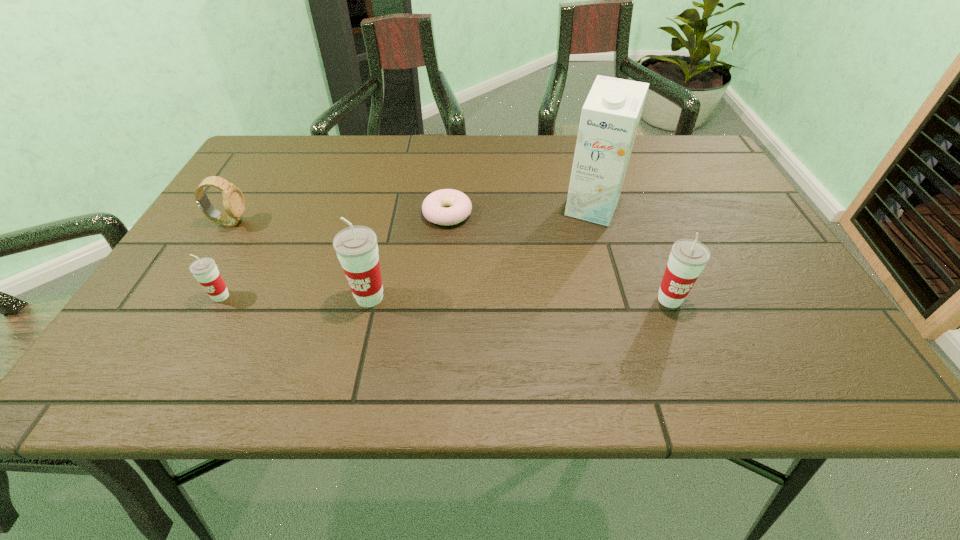
In order to click on vacant space at the far right corner in this screenshot , I will do `click(679, 170)`.

This screenshot has height=540, width=960. In order to click on free space between the leftmost object and the shortest cup in this screenshot , I will do `click(226, 260)`.

Locate an element on the screen. The width and height of the screenshot is (960, 540). empty space between the leftmost object and the doughnut is located at coordinates (338, 218).

I want to click on unoccupied position between the second cup from right to left and the shortest cup, so click(x=296, y=297).

What are the coordinates of `vacant point located between the leftmost cup and the leftmost object` in the screenshot? It's located at (226, 260).

The height and width of the screenshot is (540, 960). I want to click on free space between the shortest object and the carton, so click(x=519, y=211).

The width and height of the screenshot is (960, 540). I want to click on free space between the third object from left to right and the second object from left to right, so click(296, 297).

Where is `vacant point located between the carton and the leftmost object`? The image size is (960, 540). vacant point located between the carton and the leftmost object is located at coordinates (411, 215).

What are the coordinates of `vacant space that's between the leftmost object and the second tallest cup` in the screenshot? It's located at tap(449, 261).

The height and width of the screenshot is (540, 960). What are the coordinates of `blank region between the fourth object from left to right and the rightmost object` in the screenshot? It's located at [x=559, y=256].